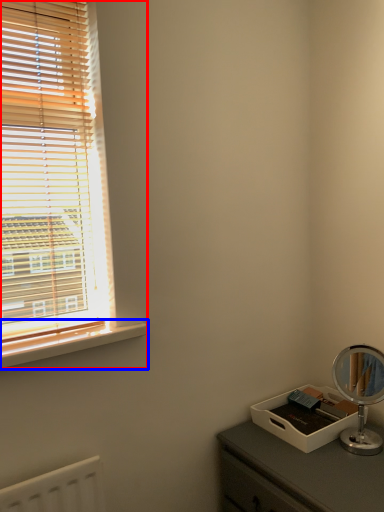
Question: Which object appears farthest to the camera in this image, window (highlighted by a red box) or window sill (highlighted by a blue box)?

Choices:
 (A) window
 (B) window sill

Answer: (B)